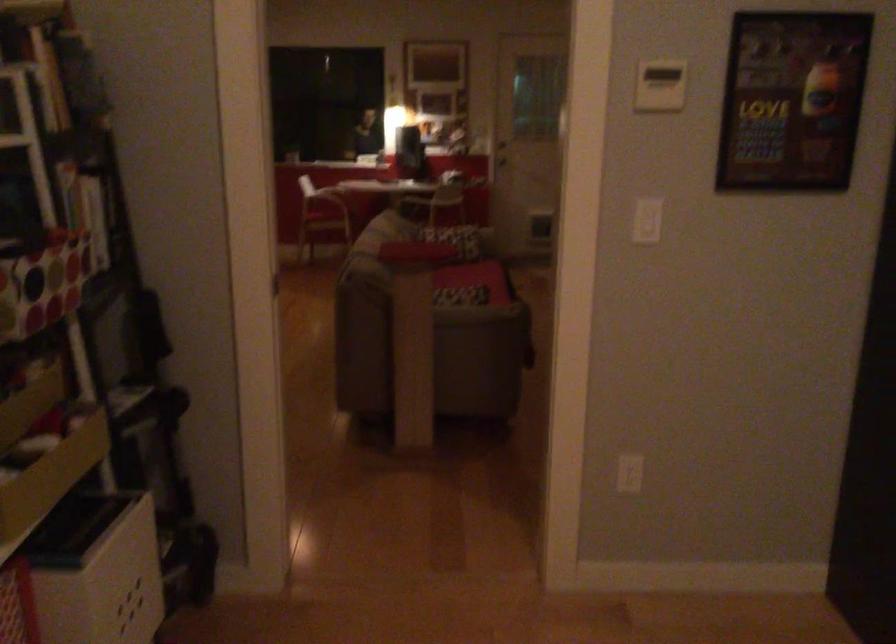
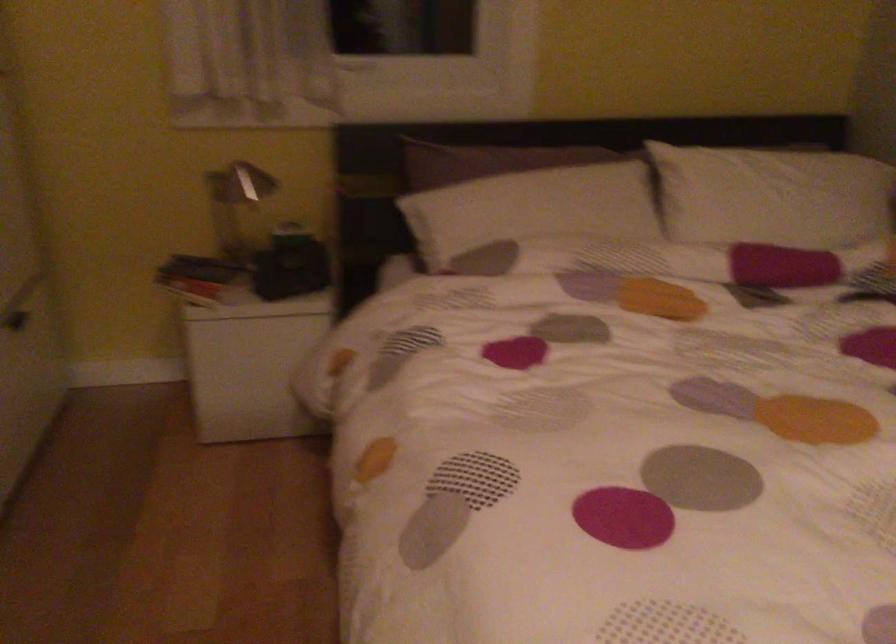
The images are taken continuously from a first-person perspective. In which direction is your viewpoint rotating?

The camera rotated toward right-down.